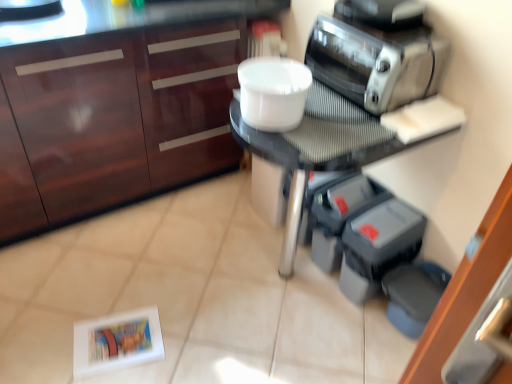
The width and height of the screenshot is (512, 384). Describe the element at coordinates (116, 103) in the screenshot. I see `matte wood cabinetry at upper left` at that location.

What is the approximate height of matte black table at center?

matte black table at center is 75.77 centimeters in height.

What do you see at coordinates (339, 215) in the screenshot? This screenshot has height=384, width=512. I see `gray plastic containers at lower right, marked as the second appliance in a right-to-left arrangement` at bounding box center [339, 215].

Describe the element at coordinates (383, 13) in the screenshot. I see `metallic silver toaster at upper right` at that location.

Locate an element on the screen. Image resolution: width=512 pixels, height=384 pixels. satin silver toaster at upper right is located at coordinates (376, 62).

Is the depth of satin silver toaster at upper right greater than that of matte black table at center?

Yes, satin silver toaster at upper right is behind matte black table at center.

Is satin silver toaster at upper right oriented towards matte black table at center?

No, satin silver toaster at upper right is not aimed at matte black table at center.

Considering the positions of objects satin silver toaster at upper right and matte black table at center in the image provided, who is more to the right, satin silver toaster at upper right or matte black table at center?

Positioned to the right is satin silver toaster at upper right.

From a real-world perspective, is satin silver toaster at upper right physically above matte black table at center?

Yes, from a real-world perspective, satin silver toaster at upper right is over matte black table at center

You are a GUI agent. You are given a task and a screenshot of the screen. Output one action in this format:
    pyautogui.click(x=<x>, y=<y>)
    Task: Click on the home appliance in front of the metallic silver toaster at upper right
    The image size is (512, 384).
    Given the screenshot: What is the action you would take?
    pyautogui.click(x=376, y=62)

Between metallic silver toaster at upper right and satin silver toaster at upper right, which one has larger width?

With larger width is metallic silver toaster at upper right.

Looking at this image, measure the distance from metallic silver toaster at upper right to satin silver toaster at upper right.

The distance of metallic silver toaster at upper right from satin silver toaster at upper right is 4.66 inches.

Is satin silver toaster at upper right a part of metallic silver toaster at upper right?

No, satin silver toaster at upper right is not a part of metallic silver toaster at upper right.

Which object is closer to the camera taking this photo, gray rubber dumbbells at lower right, which is the first appliance from right to left, or matte wood cabinetry at upper left?

matte wood cabinetry at upper left is in front.

Considering the sizes of objects gray rubber dumbbells at lower right, arranged as the 2th appliance when viewed from the left, and matte wood cabinetry at upper left in the image provided, who is thinner, gray rubber dumbbells at lower right, arranged as the 2th appliance when viewed from the left, or matte wood cabinetry at upper left?

gray rubber dumbbells at lower right, arranged as the 2th appliance when viewed from the left, is thinner.

How distant is gray rubber dumbbells at lower right, which is the first appliance from right to left, from matte wood cabinetry at upper left?

The distance of gray rubber dumbbells at lower right, which is the first appliance from right to left, from matte wood cabinetry at upper left is 38.91 inches.

Where is `cabinetry lying in front of the gray rubber dumbbells at lower right, which is the first appliance from right to left`? Image resolution: width=512 pixels, height=384 pixels. cabinetry lying in front of the gray rubber dumbbells at lower right, which is the first appliance from right to left is located at coordinates tap(116, 103).

Is gray plastic containers at lower right, the 1th appliance when ordered from left to right, taller or shorter than matte black table at center?

In the image, gray plastic containers at lower right, the 1th appliance when ordered from left to right, appears to be shorter than matte black table at center.

Based on their positions, is gray plastic containers at lower right, marked as the second appliance in a right-to-left arrangement, located to the left or right of matte black table at center?

Clearly, gray plastic containers at lower right, marked as the second appliance in a right-to-left arrangement, is on the right of matte black table at center in the image.

Locate an element on the screen. The width and height of the screenshot is (512, 384). table that appears in front of the gray plastic containers at lower right, marked as the second appliance in a right-to-left arrangement is located at coordinates [320, 148].

Is point (316, 263) positioned after point (242, 140)?

Yes, it is.

Which of these two, white plastic bowl at center or gray plastic containers at lower right, the 1th appliance when ordered from left to right, is smaller?

white plastic bowl at center.

Which of these two, white plastic bowl at center or gray plastic containers at lower right, the 1th appliance when ordered from left to right, stands taller?

With more height is gray plastic containers at lower right, the 1th appliance when ordered from left to right.

Is white plastic bowl at center in front of or behind gray plastic containers at lower right, the 1th appliance when ordered from left to right, in the image?

white plastic bowl at center is positioned closer to the viewer than gray plastic containers at lower right, the 1th appliance when ordered from left to right.

Which object is positioned more to the right, white plastic bowl at center or gray plastic containers at lower right, the 1th appliance when ordered from left to right?

From the viewer's perspective, gray plastic containers at lower right, the 1th appliance when ordered from left to right, appears more on the right side.

Looking at this image, is metallic silver toaster at upper right oriented towards gray plastic containers at lower right, marked as the second appliance in a right-to-left arrangement?

No, metallic silver toaster at upper right does not turn towards gray plastic containers at lower right, marked as the second appliance in a right-to-left arrangement.

Does point (376, 21) appear closer or farther from the camera than point (319, 256)?

Point (376, 21) is positioned closer to the camera compared to point (319, 256).

You are a GUI agent. You are given a task and a screenshot of the screen. Output one action in this format:
    pyautogui.click(x=<x>, y=<y>)
    Task: Click on the kitchen appliance located on the left of gray plastic containers at lower right, marked as the second appliance in a right-to-left arrangement
    
    Given the screenshot: What is the action you would take?
    click(x=383, y=13)

Is metallic silver toaster at upper right located outside gray plastic containers at lower right, marked as the second appliance in a right-to-left arrangement?

metallic silver toaster at upper right is positioned outside gray plastic containers at lower right, marked as the second appliance in a right-to-left arrangement.

Which is more to the right, matte wood cabinetry at upper left or gray rubber dumbbells at lower right, which is the first appliance from right to left?

From the viewer's perspective, gray rubber dumbbells at lower right, which is the first appliance from right to left, appears more on the right side.

Are matte wood cabinetry at upper left and gray rubber dumbbells at lower right, which is the first appliance from right to left, far apart?

matte wood cabinetry at upper left is actually quite close to gray rubber dumbbells at lower right, which is the first appliance from right to left.

Is matte wood cabinetry at upper left not within gray rubber dumbbells at lower right, arranged as the 2th appliance when viewed from the left?

That's correct, matte wood cabinetry at upper left is outside of gray rubber dumbbells at lower right, arranged as the 2th appliance when viewed from the left.

From the picture: From a real-world perspective, is matte wood cabinetry at upper left above or below gray rubber dumbbells at lower right, which is the first appliance from right to left?

Clearly, from a real-world perspective, matte wood cabinetry at upper left is above gray rubber dumbbells at lower right, which is the first appliance from right to left.

There is a matte black table at center. At what (x,y) coordinates should I click in order to perform the action: click on home appliance above it (from a real-world perspective). Please return your answer as a coordinate pair (x, y). This screenshot has width=512, height=384. Looking at the image, I should click on (376, 62).

At what (x,y) coordinates should I click in order to perform the action: click on home appliance on the left of the metallic silver toaster at upper right. Please return your answer as a coordinate pair (x, y). Looking at the image, I should click on (376, 62).

When comparing their distances from metallic silver toaster at upper right, does gray plastic containers at lower right, the 1th appliance when ordered from left to right, or white plastic bowl at center seem further?

Among the two, gray plastic containers at lower right, the 1th appliance when ordered from left to right, is located further to metallic silver toaster at upper right.

In the scene shown: Estimate the real-world distances between objects in this image. Which object is closer to gray rubber dumbbells at lower right, which is the first appliance from right to left, white plastic bowl at center or matte black table at center?

Based on the image, matte black table at center appears to be nearer to gray rubber dumbbells at lower right, which is the first appliance from right to left.

When comparing their distances from metallic silver toaster at upper right, does matte black table at center or satin silver toaster at upper right seem closer?

satin silver toaster at upper right is closer to metallic silver toaster at upper right.

From the image, which object appears to be farther from matte wood cabinetry at upper left, metallic silver toaster at upper right or white plastic bowl at center?

metallic silver toaster at upper right is further to matte wood cabinetry at upper left.

When comparing their distances from satin silver toaster at upper right, does matte wood cabinetry at upper left or gray plastic containers at lower right, the 1th appliance when ordered from left to right, seem closer?

gray plastic containers at lower right, the 1th appliance when ordered from left to right.

Estimate the real-world distances between objects in this image. Which object is closer to matte wood cabinetry at upper left, matte black table at center or satin silver toaster at upper right?

matte black table at center lies closer to matte wood cabinetry at upper left than the other object.

From the image, which object appears to be farther from white plastic bowl at center, matte wood cabinetry at upper left or satin silver toaster at upper right?

matte wood cabinetry at upper left is further to white plastic bowl at center.

Based on their spatial positions, is metallic silver toaster at upper right or matte black table at center closer to matte wood cabinetry at upper left?

matte black table at center is positioned closer to the anchor matte wood cabinetry at upper left.

Find the location of a particular element. This screenshot has width=512, height=384. toilet bowl between satin silver toaster at upper right and matte black table at center vertically is located at coordinates (273, 92).

Find the location of a particular element. appliance between white plastic bowl at center and gray rubber dumbbells at lower right, which is the first appliance from right to left, in the up-down direction is located at coordinates pos(339,215).

At what (x,y) coordinates should I click in order to perform the action: click on toilet bowl between satin silver toaster at upper right and gray rubber dumbbells at lower right, arranged as the 2th appliance when viewed from the left, in the vertical direction. Please return your answer as a coordinate pair (x, y). This screenshot has height=384, width=512. Looking at the image, I should click on 273,92.

Image resolution: width=512 pixels, height=384 pixels. Identify the location of table between satin silver toaster at upper right and gray rubber dumbbells at lower right, arranged as the 2th appliance when viewed from the left, from top to bottom. (320, 148).